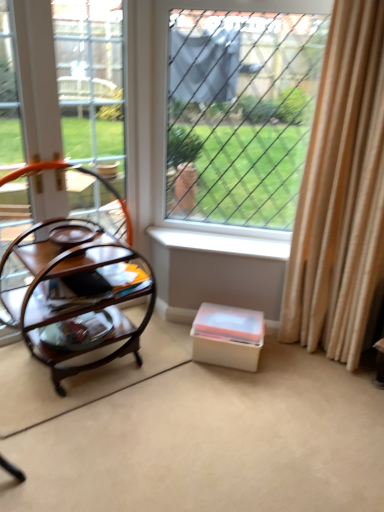
Question: Considering the relative sizes of woodenmaterial/texturetable at left and white plastic window sill at center in the image provided, is woodenmaterial/texturetable at left wider than white plastic window sill at center?

Choices:
 (A) yes
 (B) no

Answer: (A)

Question: Is woodenmaterial/texturetable at left positioned with its back to white plastic window sill at center?

Choices:
 (A) yes
 (B) no

Answer: (B)

Question: Is woodenmaterial/texturetable at left in contact with white plastic window sill at center?

Choices:
 (A) no
 (B) yes

Answer: (A)

Question: Is woodenmaterial/texturetable at left not close to white plastic window sill at center?

Choices:
 (A) yes
 (B) no

Answer: (B)

Question: From the image's perspective, does woodenmaterial/texturetable at left appear lower than white plastic window sill at center?

Choices:
 (A) no
 (B) yes

Answer: (B)

Question: Choose the correct answer: Is woodenmaterial/texturetable at left inside wire mesh at center or outside it?

Choices:
 (A) inside
 (B) outside

Answer: (B)

Question: Is point (127, 248) positioned closer to the camera than point (276, 49)?

Choices:
 (A) closer
 (B) farther

Answer: (B)

Question: From the image's perspective, is woodenmaterial/texturetable at left above or below wire mesh at center?

Choices:
 (A) below
 (B) above

Answer: (A)

Question: In the image, is woodenmaterial/texturetable at left on the left side or the right side of wire mesh at center?

Choices:
 (A) left
 (B) right

Answer: (A)

Question: Is point (52, 325) closer or farther from the camera than point (288, 252)?

Choices:
 (A) farther
 (B) closer

Answer: (B)

Question: Considering the positions of woodenmaterial/texturetable at left and white plastic window sill at center in the image, is woodenmaterial/texturetable at left wider or thinner than white plastic window sill at center?

Choices:
 (A) wide
 (B) thin

Answer: (A)

Question: From a real-world perspective, is woodenmaterial/texturetable at left physically located above or below white plastic window sill at center?

Choices:
 (A) above
 (B) below

Answer: (B)

Question: Choose the correct answer: Is woodenmaterial/texturetable at left inside white plastic window sill at center or outside it?

Choices:
 (A) outside
 (B) inside

Answer: (A)

Question: Considering the positions of point (342, 287) and point (226, 326), is point (342, 287) closer or farther from the camera than point (226, 326)?

Choices:
 (A) closer
 (B) farther

Answer: (A)

Question: In terms of size, does beige fabric curtain at right appear bigger or smaller than white plastic storage box at lower center?

Choices:
 (A) big
 (B) small

Answer: (A)